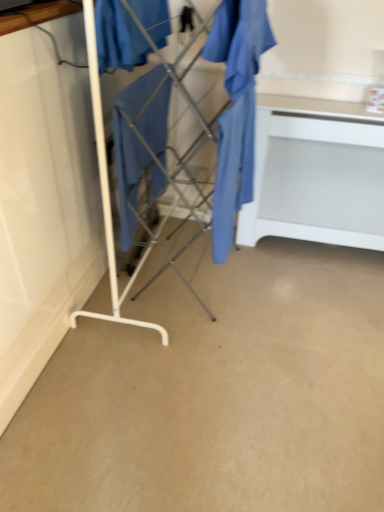
Question: Does beige carpet at center have a smaller size compared to matte blue fabric at center, the first clothing from the right?

Choices:
 (A) yes
 (B) no

Answer: (B)

Question: Considering the relative sizes of beige carpet at center and matte blue fabric at center, the first clothing from the right, in the image provided, is beige carpet at center taller than matte blue fabric at center, the first clothing from the right,?

Choices:
 (A) no
 (B) yes

Answer: (A)

Question: From a real-world perspective, is beige carpet at center located higher than matte blue fabric at center, the first clothing from the right?

Choices:
 (A) yes
 (B) no

Answer: (B)

Question: Does beige carpet at center have a lesser height compared to matte blue fabric at center, the first clothing from the right?

Choices:
 (A) yes
 (B) no

Answer: (A)

Question: Does beige carpet at center have a larger size compared to matte blue fabric at center, the first clothing from the right?

Choices:
 (A) yes
 (B) no

Answer: (A)

Question: Is beige carpet at center outside of matte blue fabric at center, arranged as the 3th clothing when viewed from the left?

Choices:
 (A) no
 (B) yes

Answer: (B)

Question: Does matte blue fabric at center, arranged as the 3th clothing when viewed from the right, contain matte blue fabric at center, arranged as the 3th clothing when viewed from the left?

Choices:
 (A) yes
 (B) no

Answer: (B)

Question: Can you confirm if matte blue fabric at center, arranged as the 3th clothing when viewed from the right, is positioned to the left of matte blue fabric at center, arranged as the 3th clothing when viewed from the left?

Choices:
 (A) yes
 (B) no

Answer: (A)

Question: From a real-world perspective, does matte blue fabric at center, arranged as the 3th clothing when viewed from the right, stand above matte blue fabric at center, arranged as the 3th clothing when viewed from the left?

Choices:
 (A) no
 (B) yes

Answer: (B)

Question: Is matte blue fabric at center, arranged as the 3th clothing when viewed from the right, beside matte blue fabric at center, the first clothing from the right?

Choices:
 (A) no
 (B) yes

Answer: (A)

Question: Considering the relative sizes of matte blue fabric at center, arranged as the 3th clothing when viewed from the right, and matte blue fabric at center, the first clothing from the right, in the image provided, is matte blue fabric at center, arranged as the 3th clothing when viewed from the right, thinner than matte blue fabric at center, the first clothing from the right,?

Choices:
 (A) no
 (B) yes

Answer: (A)

Question: From a real-world perspective, is matte blue fabric at center, the 1th clothing when ordered from left to right, positioned under matte blue fabric at center, the first clothing from the right, based on gravity?

Choices:
 (A) yes
 (B) no

Answer: (B)

Question: From a real-world perspective, does white matte table at center sit lower than metal drying rack at center?

Choices:
 (A) yes
 (B) no

Answer: (A)